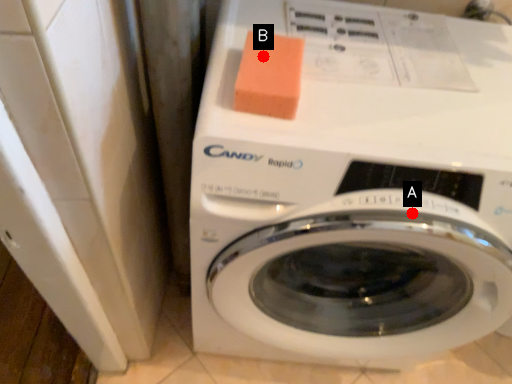
Question: Two points are circled on the image, labeled by A and B beside each circle. Which point appears closest to the camera in this image?

Choices:
 (A) A is closer
 (B) B is closer

Answer: (A)